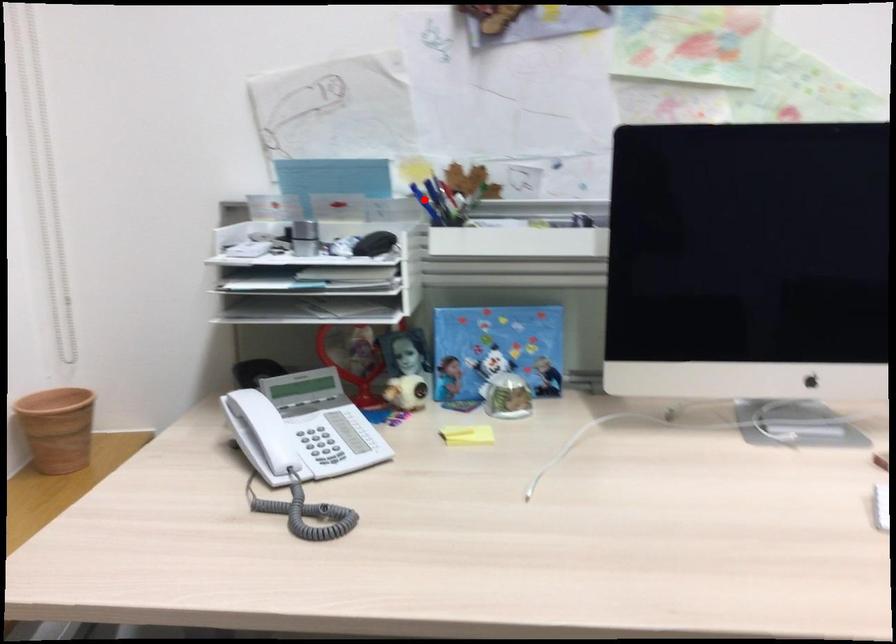
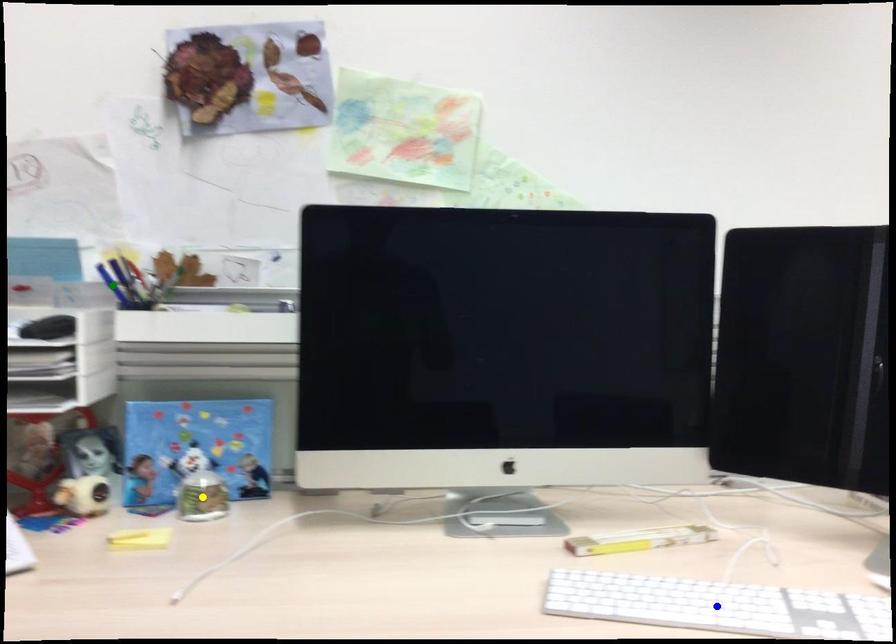
Question: I am providing you with two images of the same scene from different viewpoints. A red point is marked on the first image. You are given multiple points on the second image. Can you choose the point in image 2 that corresponds to the point in image 1?

Choices:
 (A) blue point
 (B) green point
 (C) yellow point

Answer: (B)